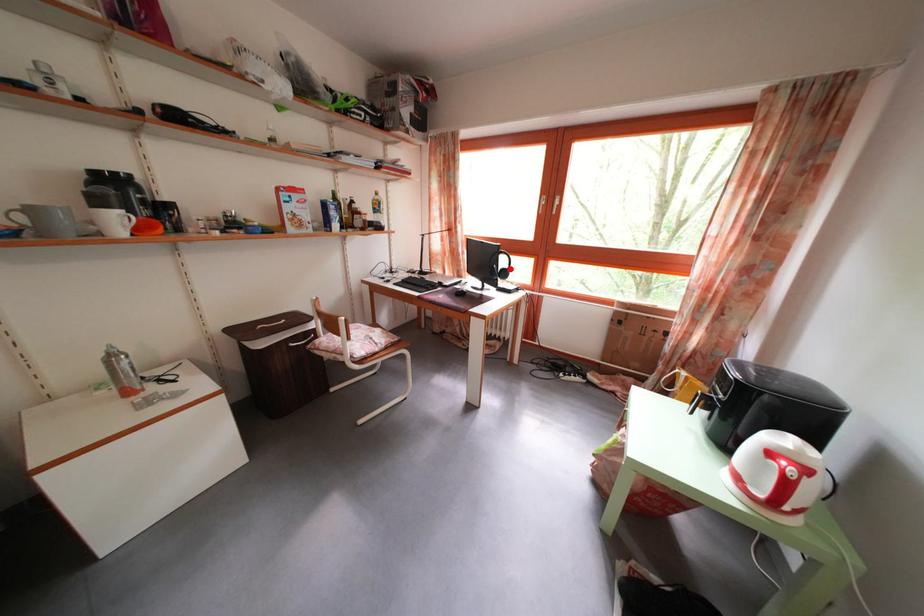
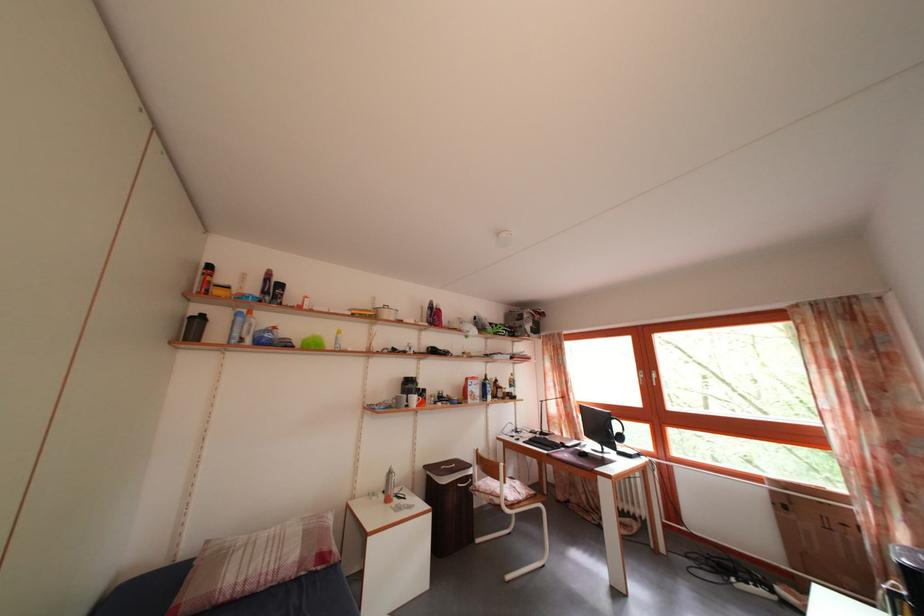
Find the pixel in the second image that matches the highlighted location in the first image.

(624, 434)